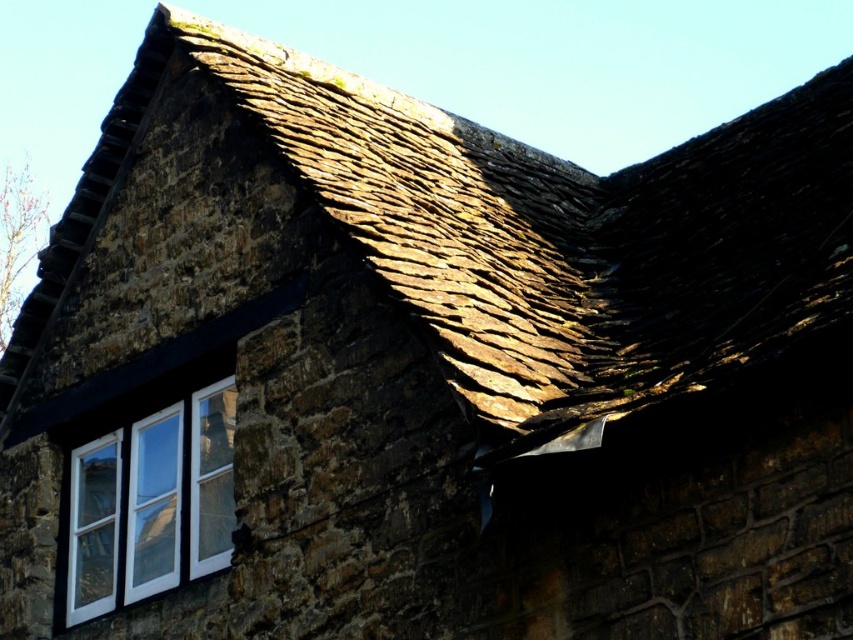
The width and height of the screenshot is (853, 640). What do you see at coordinates (526, 230) in the screenshot?
I see `brown shingles at upper center` at bounding box center [526, 230].

Where is `brown shingles at upper center`? This screenshot has width=853, height=640. brown shingles at upper center is located at coordinates (526, 230).